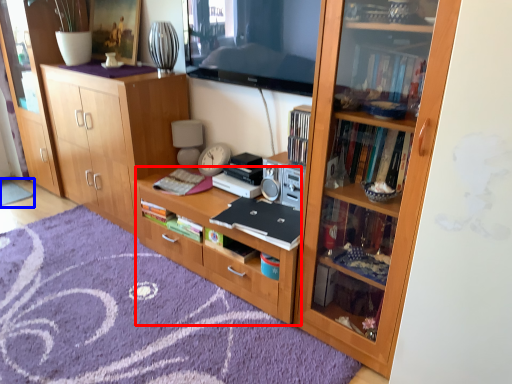
Question: Which object appears farthest to the camera in this image, desk (highlighted by a red box) or doormat (highlighted by a blue box)?

Choices:
 (A) desk
 (B) doormat

Answer: (B)